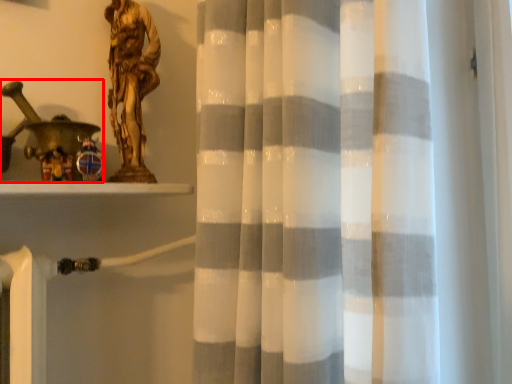
Question: From the image, what is the correct spatial relationship of toy (annotated by the red box) in relation to sculpture?

Choices:
 (A) right
 (B) left

Answer: (B)